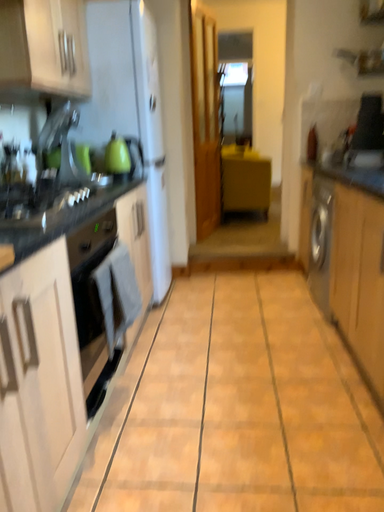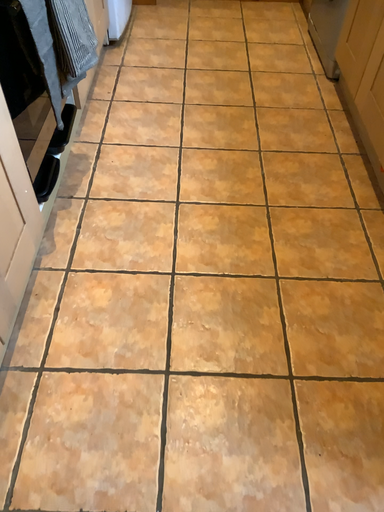
Question: Which way did the camera rotate in the video?

Choices:
 (A) rotated downward
 (B) rotated upward

Answer: (A)